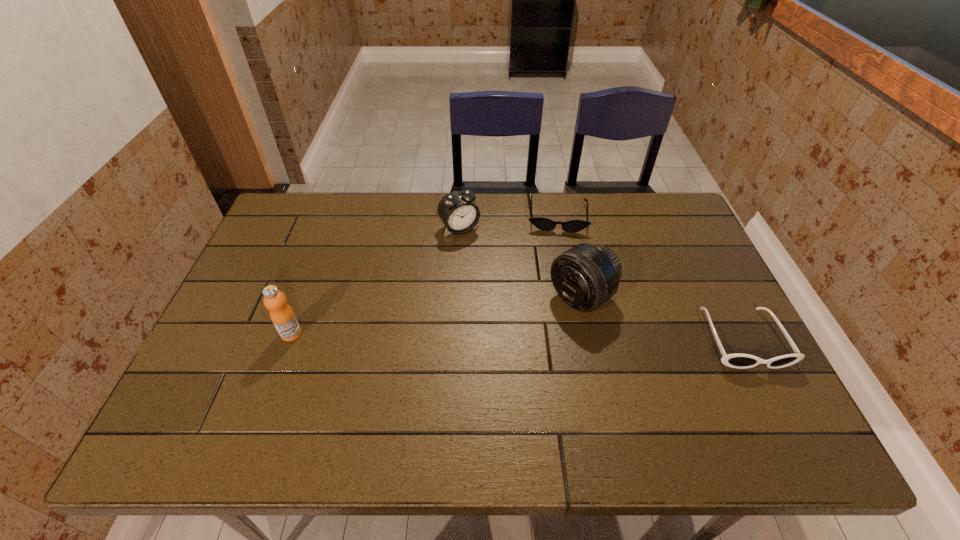
Image resolution: width=960 pixels, height=540 pixels. Identify the location of vacant area that lies between the orange juice and the alarm clock. (375, 281).

Locate an element on the screen. This screenshot has height=540, width=960. free point between the telephoto lens and the orange juice is located at coordinates click(x=437, y=315).

At what (x,y) coordinates should I click in order to perform the action: click on free spot between the telephoto lens and the second object from left to right. Please return your answer as a coordinate pair (x, y). The width and height of the screenshot is (960, 540). Looking at the image, I should click on (520, 263).

Where is `the third closest object to the orange juice`? The width and height of the screenshot is (960, 540). the third closest object to the orange juice is located at coordinates (545, 224).

Identify which object is the fourth closest to the orange juice. Please provide its 2D coordinates. Your answer should be formatted as a tuple, i.e. [(x, y)], where the tuple contains the x and y coordinates of a point satisfying the conditions above.

[(741, 361)]

The width and height of the screenshot is (960, 540). I want to click on vacant position in the image that satisfies the following two spatial constraints: 1. on the front side of the telephoto lens; 2. on the right side of the shortest object, so click(573, 298).